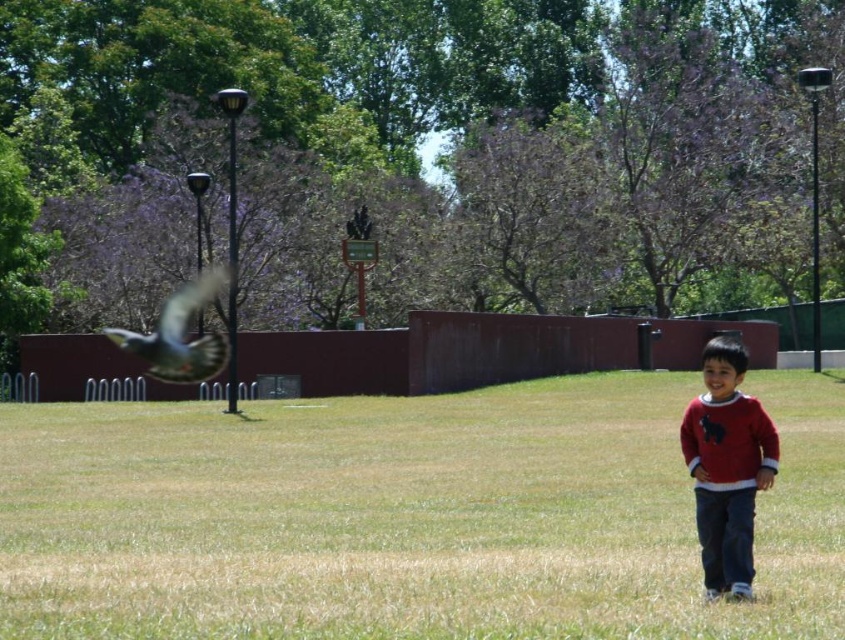
Which is above, green grass at lower right or red cotton sweater at lower right?

red cotton sweater at lower right is above.

Is green grass at lower right behind red cotton sweater at lower right?

No, green grass at lower right is in front of red cotton sweater at lower right.

Is point (668, 531) positioned before point (742, 413)?

No, (668, 531) is further to viewer.

The height and width of the screenshot is (640, 845). In order to click on green grass at lower right in this screenshot , I will do `click(407, 515)`.

In the scene shown: Which of these two, red cotton sweater at lower right or gray feathered bird at left, stands taller?

Standing taller between the two is gray feathered bird at left.

Is red cotton sweater at lower right bigger than gray feathered bird at left?

Actually, red cotton sweater at lower right might be smaller than gray feathered bird at left.

Between point (737, 506) and point (186, 378), which one is positioned in front?

Positioned in front is point (737, 506).

Locate an element on the screen. This screenshot has height=640, width=845. red cotton sweater at lower right is located at coordinates (726, 467).

You are a GUI agent. You are given a task and a screenshot of the screen. Output one action in this format:
    pyautogui.click(x=<x>, y=<y>)
    Task: Click on the green grass at lower right
    Image resolution: width=845 pixels, height=640 pixels.
    Given the screenshot: What is the action you would take?
    pyautogui.click(x=407, y=515)

Find the location of `green grass at lower right`. green grass at lower right is located at coordinates (407, 515).

Find the location of a particular element. This screenshot has width=845, height=640. green grass at lower right is located at coordinates (407, 515).